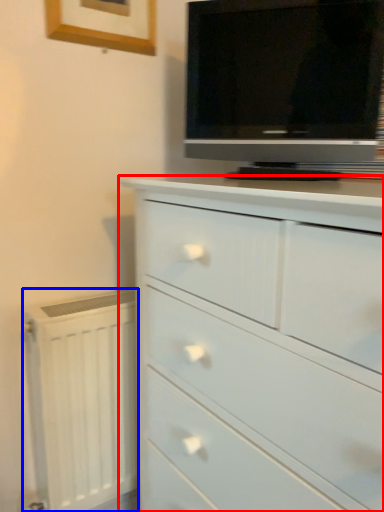
Question: Which of the following is the closest to the observer, chest of drawers (highlighted by a red box) or radiator (highlighted by a blue box)?

Choices:
 (A) chest of drawers
 (B) radiator

Answer: (A)